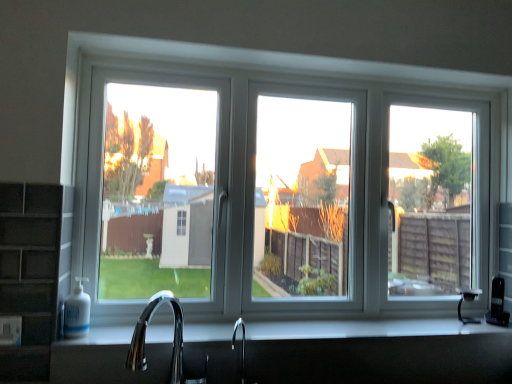
Question: From the image's perspective, is white plastic window at center below chrome metallic faucet at lower center?

Choices:
 (A) yes
 (B) no

Answer: (B)

Question: Considering the relative positions of white plastic window at center and chrome metallic faucet at lower center in the image provided, is white plastic window at center to the left of chrome metallic faucet at lower center from the viewer's perspective?

Choices:
 (A) no
 (B) yes

Answer: (A)

Question: From a real-world perspective, is white plastic window at center under chrome metallic faucet at lower center?

Choices:
 (A) no
 (B) yes

Answer: (A)

Question: Does white plastic window at center turn towards chrome metallic faucet at lower center?

Choices:
 (A) no
 (B) yes

Answer: (B)

Question: Is white plastic window at center closer to the viewer compared to chrome metallic faucet at lower center?

Choices:
 (A) no
 (B) yes

Answer: (A)

Question: Is white plastic window at center in front of or behind chrome metallic faucet at lower center in the image?

Choices:
 (A) behind
 (B) front

Answer: (A)

Question: From the image's perspective, is white plastic window at center located above or below chrome metallic faucet at lower center?

Choices:
 (A) below
 (B) above

Answer: (B)

Question: Is white plastic window at center inside the boundaries of chrome metallic faucet at lower center, or outside?

Choices:
 (A) inside
 (B) outside

Answer: (B)

Question: From a real-world perspective, is white plastic window at center physically located above or below chrome metallic faucet at lower center?

Choices:
 (A) above
 (B) below

Answer: (A)

Question: Considering their positions, is chrome metallic faucet at lower center located in front of or behind white glossy countertop at center?

Choices:
 (A) behind
 (B) front

Answer: (B)

Question: Considering the positions of chrome metallic faucet at lower center and white glossy countertop at center in the image, is chrome metallic faucet at lower center taller or shorter than white glossy countertop at center?

Choices:
 (A) short
 (B) tall

Answer: (B)

Question: From a real-world perspective, relative to white glossy countertop at center, is chrome metallic faucet at lower center vertically above or below?

Choices:
 (A) below
 (B) above

Answer: (B)

Question: Is chrome metallic faucet at lower center wider or thinner than white glossy countertop at center?

Choices:
 (A) thin
 (B) wide

Answer: (A)

Question: Based on their positions, is white glossy countertop at center located to the left or right of chrome metallic faucet at lower center?

Choices:
 (A) right
 (B) left

Answer: (A)

Question: From a real-world perspective, is white glossy countertop at center positioned above or below chrome metallic faucet at lower center?

Choices:
 (A) below
 (B) above

Answer: (A)